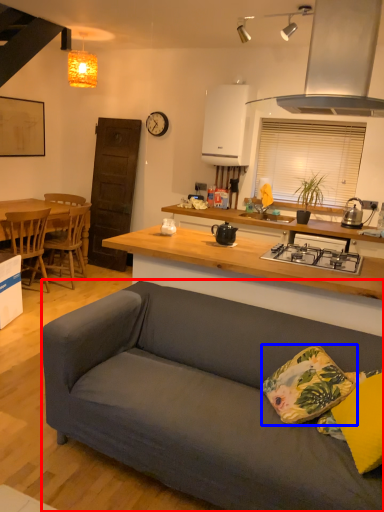
Question: Among these objects, which one is farthest to the camera, studio couch (highlighted by a red box) or pillow (highlighted by a blue box)?

Choices:
 (A) studio couch
 (B) pillow

Answer: (A)